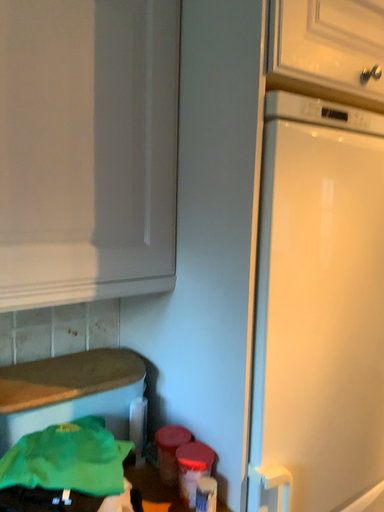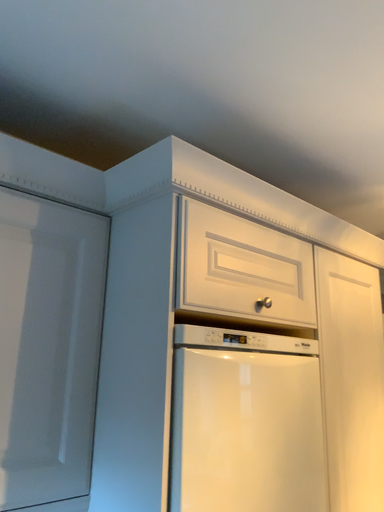
Question: How did the camera likely rotate when shooting the video?

Choices:
 (A) rotated right
 (B) rotated left

Answer: (A)